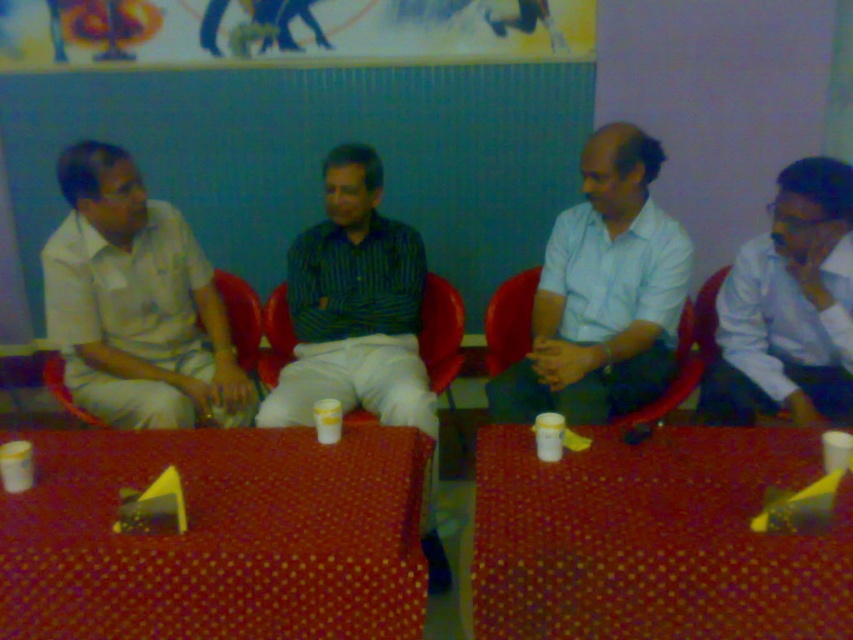
Question: Can you confirm if polka dot fabric table at lower center is wider than striped cotton shirt at center?

Choices:
 (A) yes
 (B) no

Answer: (A)

Question: Among these objects, which one is nearest to the camera?

Choices:
 (A) white shirt at right
 (B) striped cotton shirt at center
 (C) white matte shirt at left
 (D) red dotted table at center

Answer: (D)

Question: Which object appears closest to the camera in this image?

Choices:
 (A) red dotted table at center
 (B) white shirt at right
 (C) striped cotton shirt at center

Answer: (A)

Question: Which of these objects is positioned farthest from the light blue shirt at center?

Choices:
 (A) matte plastic chair at center
 (B) white shirt at right
 (C) red dotted table at center

Answer: (C)

Question: Does polka dot fabric table at lower center have a greater width compared to striped cotton shirt at center?

Choices:
 (A) no
 (B) yes

Answer: (B)

Question: Does polka dot fabric table at lower center appear on the left side of white matte shirt at left?

Choices:
 (A) yes
 (B) no

Answer: (B)